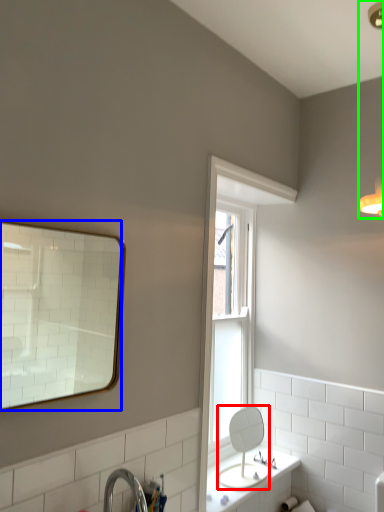
Question: Estimate the real-world distances between objects in this image. Which object is closer to mirror (highlighted by a red box), mirror (highlighted by a blue box) or light fixture (highlighted by a green box)?

Choices:
 (A) mirror
 (B) light fixture

Answer: (B)